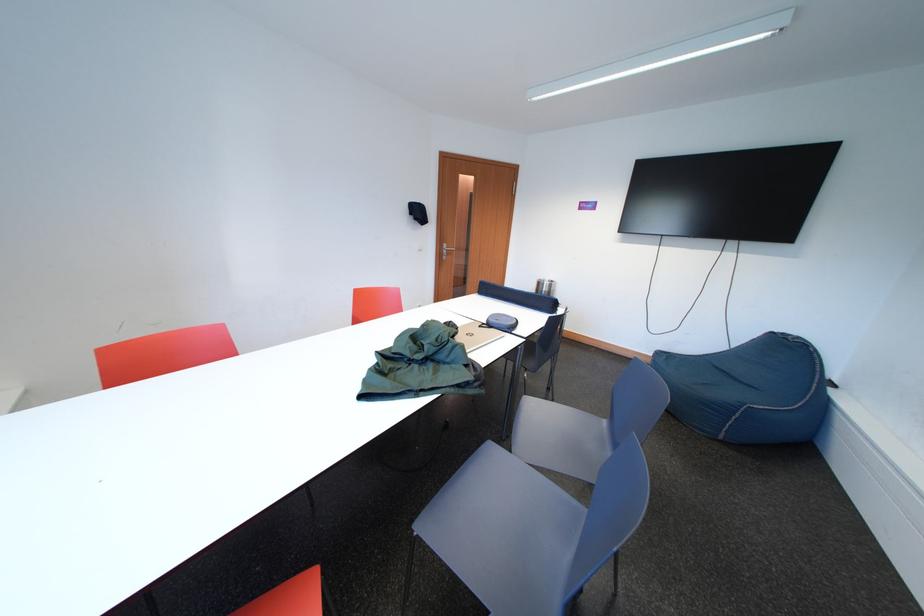
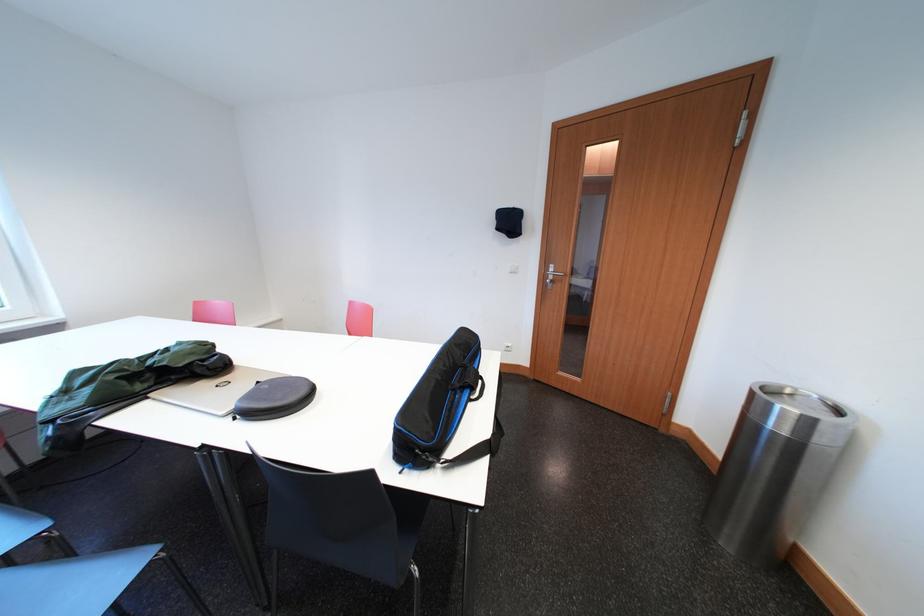
Where in the second image is the point corresponding to (490,330) from the first image?

(268, 387)